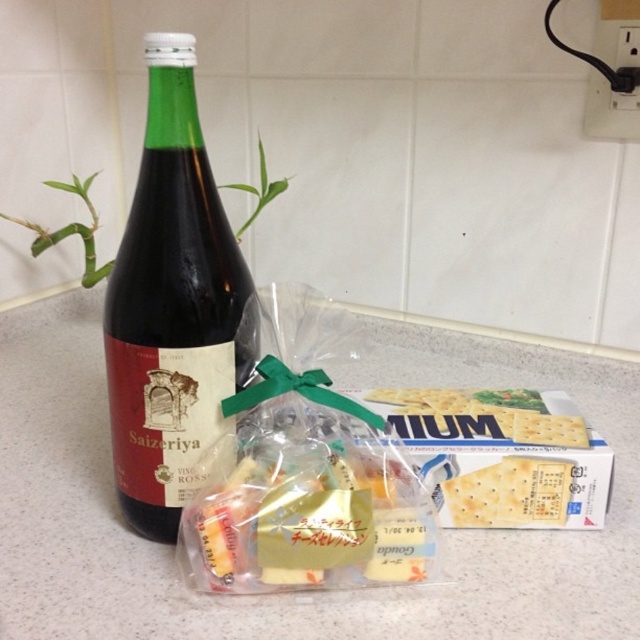
Is green glass bottle at left to the left of light brown crisp at center from the viewer's perspective?

Yes, green glass bottle at left is to the left of light brown crisp at center.

Which is in front, point (186, 436) or point (522, 525)?

Point (186, 436)

Which is behind, point (173, 189) or point (541, 506)?

The point (541, 506) is more distant.

I want to click on green glass bottle at left, so click(170, 305).

Between white matte crackers at center and light brown crisp at center, which one is positioned lower?

light brown crisp at center

Locate an element on the screen. The width and height of the screenshot is (640, 640). white matte crackers at center is located at coordinates (481, 417).

Where is `white matte crackers at center`? The height and width of the screenshot is (640, 640). white matte crackers at center is located at coordinates (481, 417).

Which is more to the right, green glass bottle at left or white matte crackers at center?

white matte crackers at center

Is green glass bottle at left to the right of white matte crackers at center from the viewer's perspective?

In fact, green glass bottle at left is to the left of white matte crackers at center.

Which is behind, point (176, 308) or point (554, 419)?

The point (554, 419) is more distant.

Locate an element on the screen. This screenshot has width=640, height=640. green glass bottle at left is located at coordinates [x=170, y=305].